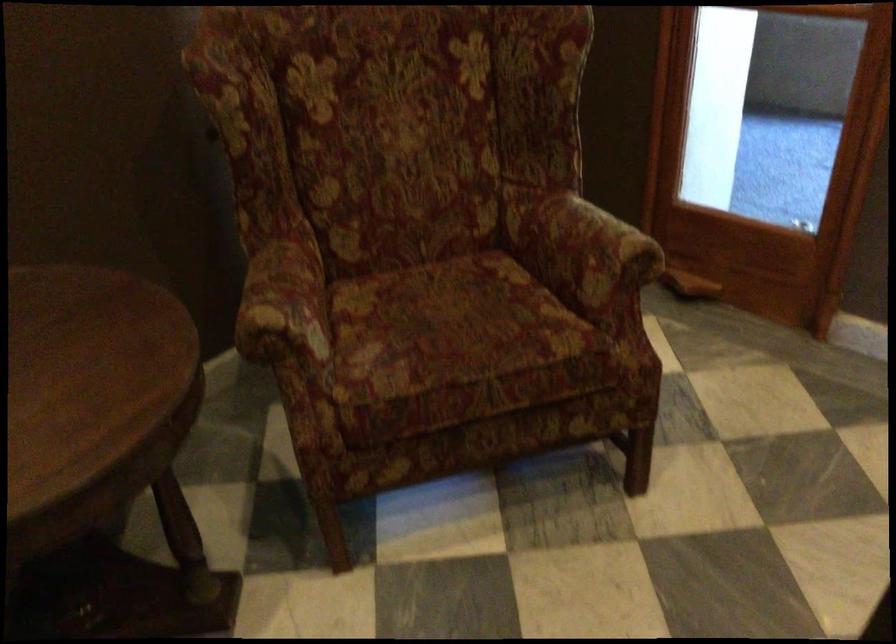
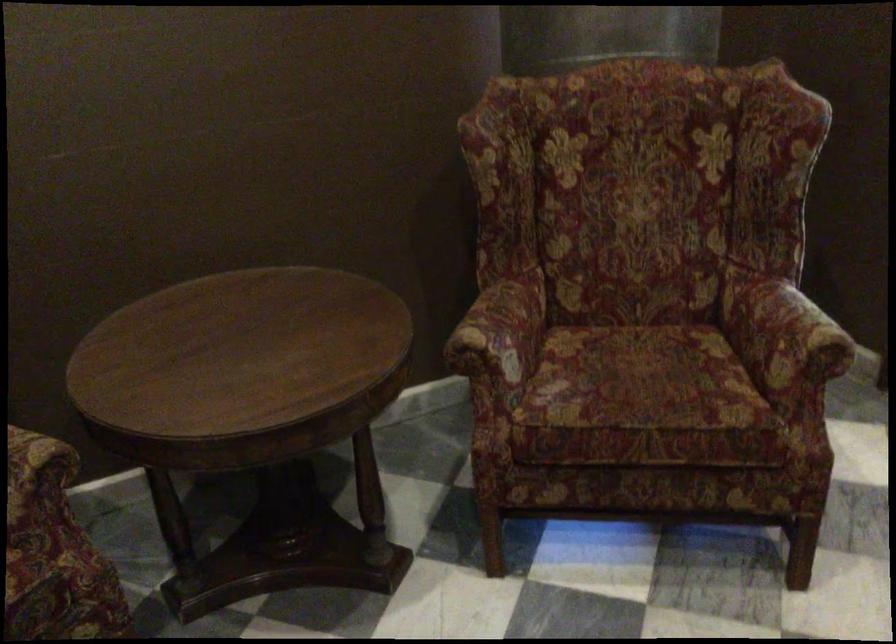
In the second image, find the point that corresponds to point (461, 327) in the first image.

(642, 381)